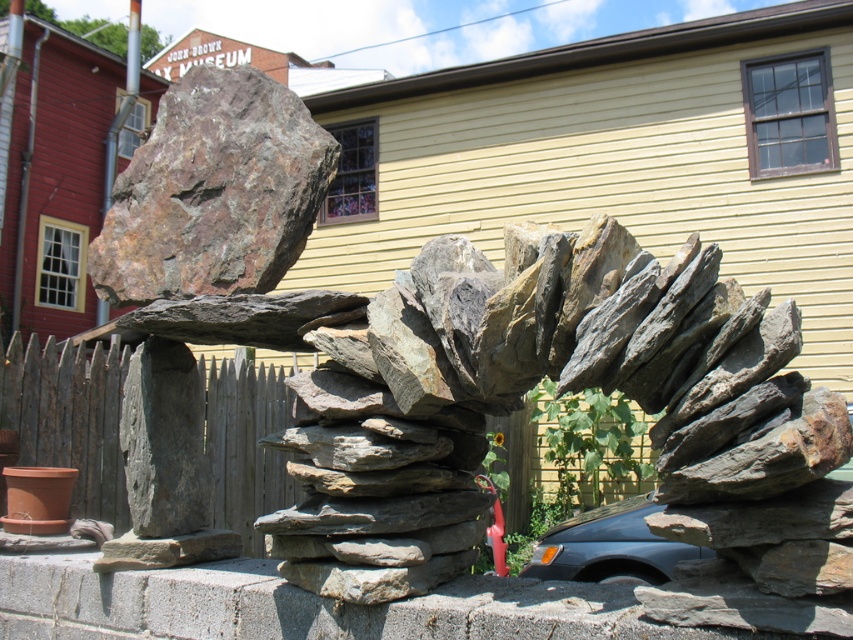
You are a photographer standing at the base of the rock sculpture. You want to take a photo of the rusty metallic boulder at upper left while ensuring the entire sculpture fits in the frame. Given that your camera has a maximum focal length of 50mm, can you estimate if you need to move closer or farther away from the sculpture to capture the entire structure without cropping?

The rusty metallic boulder at upper left is 16.54 feet away from the camera. To capture the entire sculpture in the frame with a 50mm lens, you would need to ensure that the distance allows the lens to encompass the sculpture. Since the sculpture is dynamic and tiered, moving slightly farther back might help include all elements, but the exact adjustment depends on the camera sensor size and field of view. However, given the existing distance, you might already be at an optimal position.

In the scene shown: You are a landscape designer planning to replace the rusty metallic boulder at upper left with a new decorative rock. Considering the wooden picket fence at left is 1.2 meters wide, what is the minimum width your new rock should be to ensure it is wider than the fence?

The rusty metallic boulder at upper left might be wider than wooden picket fence at left. Since the fence is 1.2 meters wide, the new rock should be at least 1.2 meters wide to possibly exceed the fence width.